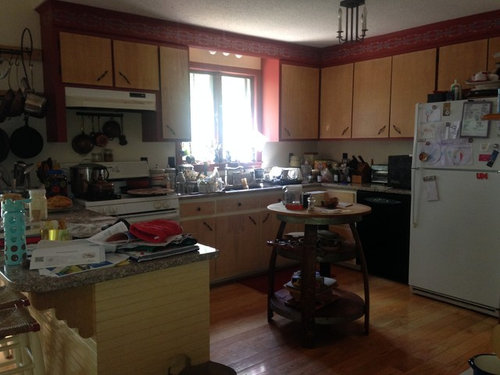
The height and width of the screenshot is (375, 500). What are the coordinates of `oven` in the screenshot? It's located at (125, 200).